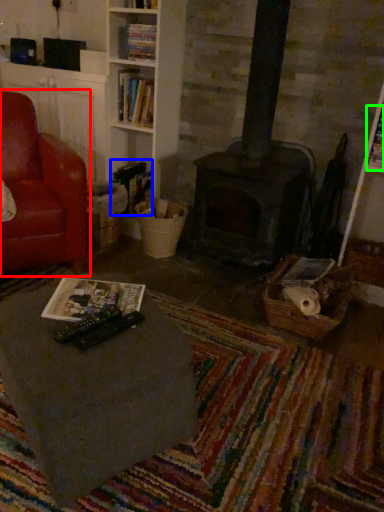
Question: Considering the real-world distances, which object is farthest from chair (highlighted by a red box)? book (highlighted by a blue box) or magazine (highlighted by a green box)?

Choices:
 (A) book
 (B) magazine

Answer: (B)